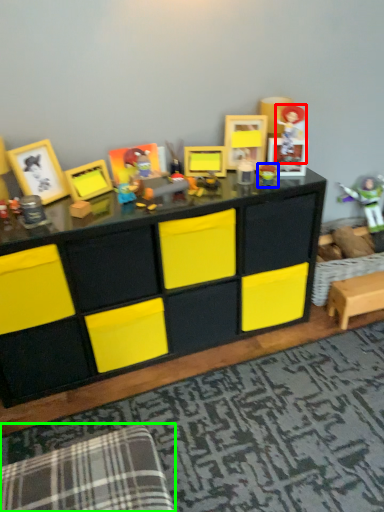
Question: Estimate the real-world distances between objects in this image. Which object is farther from toy (highlighted by a red box), toy (highlighted by a blue box) or swivel chair (highlighted by a green box)?

Choices:
 (A) toy
 (B) swivel chair

Answer: (B)